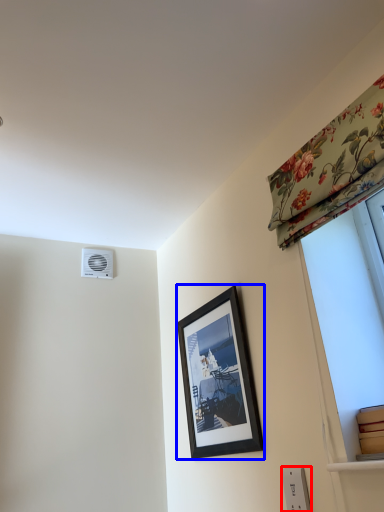
Question: Which object appears farthest to the camera in this image, electric outlet (highlighted by a red box) or picture frame (highlighted by a blue box)?

Choices:
 (A) electric outlet
 (B) picture frame

Answer: (B)